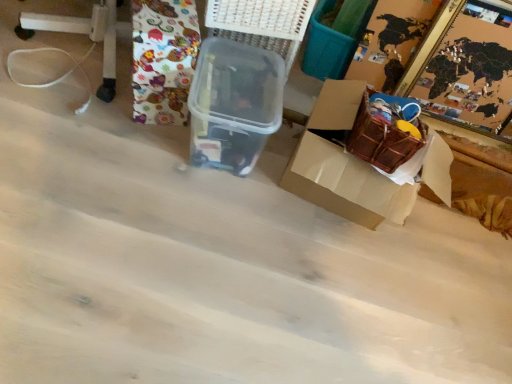
This screenshot has height=384, width=512. In order to click on vacant region to the right of brown cardboard box at lower right in this screenshot , I will do tap(458, 265).